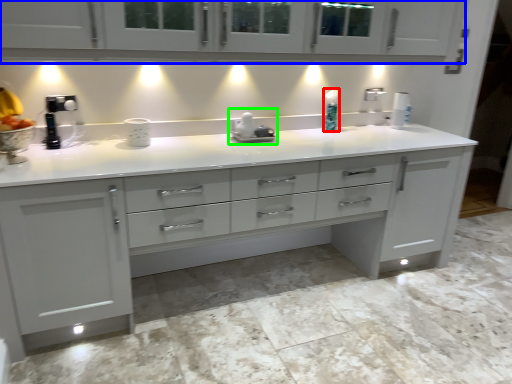
Question: Which object is the closest to the soap dispenser (highlighted by a red box)? Choose among these: cabinetry (highlighted by a blue box) or appliance (highlighted by a green box).

Choices:
 (A) cabinetry
 (B) appliance

Answer: (B)